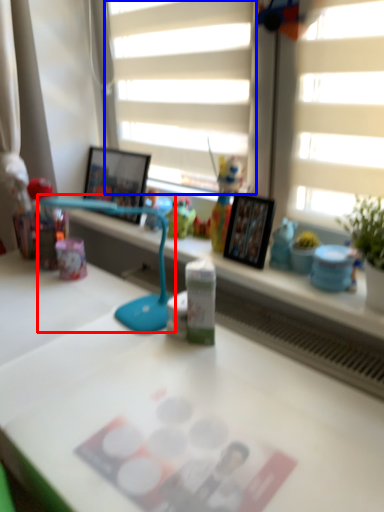
Question: Which of the following is the farthest to the observer, table lamp (highlighted by a red box) or blind (highlighted by a blue box)?

Choices:
 (A) table lamp
 (B) blind

Answer: (B)